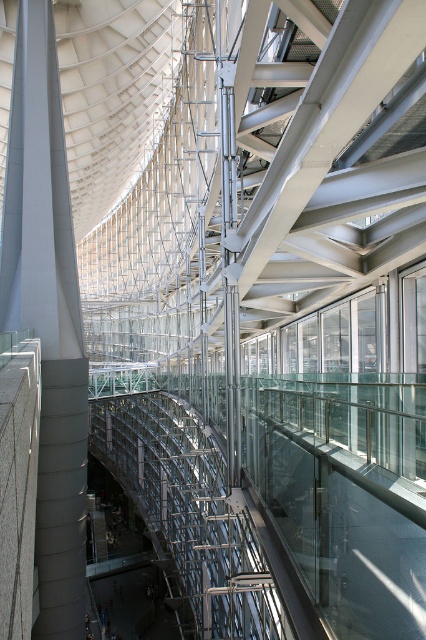
Between smooth gray pillar at left and transparent glass scaffolding at center, which one has more height?

smooth gray pillar at left is taller.

Is the position of smooth gray pillar at left less distant than that of transparent glass scaffolding at center?

No, it is not.

Identify the location of smooth gray pillar at left. This screenshot has width=426, height=640. (48, 314).